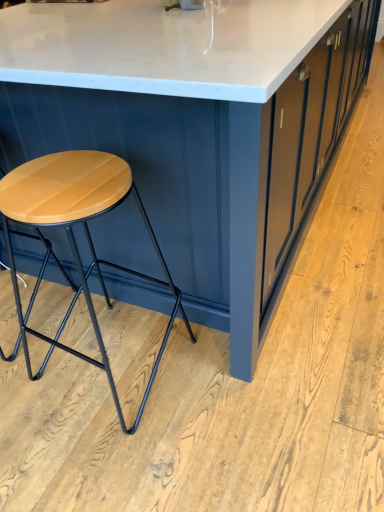
I want to click on free space above wooden matte stool at left (from a real-world perspective), so click(63, 180).